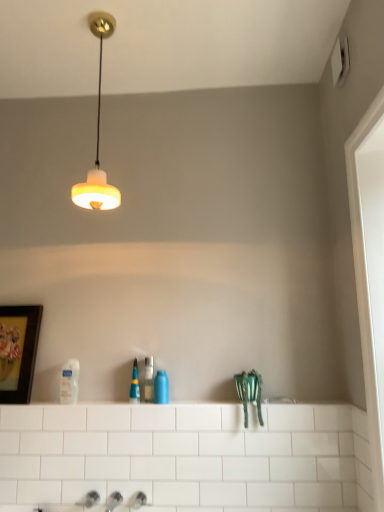
Where is `white glossy ledge at center`? Image resolution: width=384 pixels, height=512 pixels. white glossy ledge at center is located at coordinates (280, 400).

The image size is (384, 512). Find the location of `white glossy lotion at lower left, which is counted as the 3th toiletry, starting from the right`. white glossy lotion at lower left, which is counted as the 3th toiletry, starting from the right is located at coordinates (69, 382).

Identify the location of white glossy ledge at center. This screenshot has height=512, width=384. (280, 400).

Which is more distant, (154, 379) or (25, 392)?

The point (25, 392) is farther.

From a real-world perspective, is blue glossy bottle at center, which is the 1th toiletry in right-to-left order, over wooden framed artwork at left?

No, from a real-world perspective, blue glossy bottle at center, which is the 1th toiletry in right-to-left order, is not on top of wooden framed artwork at left.

Is blue glossy bottle at center, which is the third toiletry in left-to-right order, positioned far away from wooden framed artwork at left?

No, blue glossy bottle at center, which is the third toiletry in left-to-right order, is in close proximity to wooden framed artwork at left.

Is white glossy lotion at lower left, which is counted as the 3th toiletry, starting from the right, oriented away from matte white lampshade at upper center?

No, matte white lampshade at upper center is not at the back of white glossy lotion at lower left, which is counted as the 3th toiletry, starting from the right.

Between white glossy lotion at lower left, arranged as the first toiletry when viewed from the left, and matte white lampshade at upper center, which one appears on the right side from the viewer's perspective?

matte white lampshade at upper center is more to the right.

Which is closer to the camera, (x=61, y=381) or (x=105, y=175)?

The point (x=61, y=381) is closer to the camera.

Is translucent plastic bottle at center, the second toiletry from the left, taller or shorter than wooden framed artwork at left?

Clearly, translucent plastic bottle at center, the second toiletry from the left, is shorter compared to wooden framed artwork at left.

From the image's perspective, which object appears higher, translucent plastic bottle at center, marked as the 2th toiletry in a right-to-left arrangement, or wooden framed artwork at left?

wooden framed artwork at left is shown above in the image.

Is translucent plastic bottle at center, the second toiletry from the left, positioned with its back to wooden framed artwork at left?

No, wooden framed artwork at left is not at the back of translucent plastic bottle at center, the second toiletry from the left.

Does translucent plastic bottle at center, marked as the 2th toiletry in a right-to-left arrangement, have a lesser width compared to wooden framed artwork at left?

No.

At what (x,y) coordinates should I click in order to perform the action: click on ledge in front of the blue glossy bottle at center, which is the 1th toiletry in right-to-left order. Please return your answer as a coordinate pair (x, y). Looking at the image, I should click on (x=280, y=400).

Which object is thinner, white glossy ledge at center or blue glossy bottle at center, which is the third toiletry in left-to-right order?

Thinner between the two is blue glossy bottle at center, which is the third toiletry in left-to-right order.

Considering their positions, is white glossy ledge at center located in front of or behind blue glossy bottle at center, which is the 1th toiletry in right-to-left order?

white glossy ledge at center is positioned closer to the viewer than blue glossy bottle at center, which is the 1th toiletry in right-to-left order.

From the image's perspective, is white glossy ledge at center on top of blue glossy bottle at center, which is the third toiletry in left-to-right order?

No, from the image's perspective, white glossy ledge at center is not on top of blue glossy bottle at center, which is the third toiletry in left-to-right order.

Based on the photo, in the image, is white glossy lotion at lower left, which is counted as the 3th toiletry, starting from the right, positioned in front of or behind white glossy ledge at center?

white glossy lotion at lower left, which is counted as the 3th toiletry, starting from the right, is behind white glossy ledge at center.

Which toiletry is the 2nd one when counting from the back of the white glossy ledge at center? Please provide its 2D coordinates.

[(69, 382)]

Looking at this image, measure the distance between white glossy lotion at lower left, arranged as the first toiletry when viewed from the left, and white glossy ledge at center.

The distance of white glossy lotion at lower left, arranged as the first toiletry when viewed from the left, from white glossy ledge at center is 36.57 inches.

Which of these two, white glossy lotion at lower left, which is counted as the 3th toiletry, starting from the right, or white glossy ledge at center, is thinner?

With smaller width is white glossy lotion at lower left, which is counted as the 3th toiletry, starting from the right.

Is wooden framed artwork at left facing towards matte white lampshade at upper center?

No, wooden framed artwork at left is not aimed at matte white lampshade at upper center.

From the image's perspective, between wooden framed artwork at left and matte white lampshade at upper center, who is located below?

wooden framed artwork at left, from the image's perspective.

Between point (23, 371) and point (106, 13), which one is positioned in front?

Positioned in front is point (106, 13).

Measure the distance from translucent plastic bottle at center, marked as the 2th toiletry in a right-to-left arrangement, to white glossy lotion at lower left, which is counted as the 3th toiletry, starting from the right.

The distance of translucent plastic bottle at center, marked as the 2th toiletry in a right-to-left arrangement, from white glossy lotion at lower left, which is counted as the 3th toiletry, starting from the right, is 13.54 inches.

In the scene shown: From the image's perspective, between translucent plastic bottle at center, marked as the 2th toiletry in a right-to-left arrangement, and white glossy lotion at lower left, arranged as the first toiletry when viewed from the left, who is located below?

From the image's view, translucent plastic bottle at center, marked as the 2th toiletry in a right-to-left arrangement, is below.

Based on their sizes in the image, would you say translucent plastic bottle at center, marked as the 2th toiletry in a right-to-left arrangement, is bigger or smaller than white glossy lotion at lower left, arranged as the first toiletry when viewed from the left?

translucent plastic bottle at center, marked as the 2th toiletry in a right-to-left arrangement, is smaller than white glossy lotion at lower left, arranged as the first toiletry when viewed from the left.

Which object is thinner, translucent plastic bottle at center, the second toiletry from the left, or white glossy lotion at lower left, which is counted as the 3th toiletry, starting from the right?

white glossy lotion at lower left, which is counted as the 3th toiletry, starting from the right, is thinner.

At what (x,y) coordinates should I click in order to perform the action: click on picture frame above the blue glossy bottle at center, which is the 1th toiletry in right-to-left order (from a real-world perspective). Please return your answer as a coordinate pair (x, y). The width and height of the screenshot is (384, 512). Looking at the image, I should click on (20, 352).

From a real-world perspective, which toiletry is the 1st one underneath the matte white lampshade at upper center? Please provide its 2D coordinates.

[(69, 382)]

Looking at the image, which one is located further to white glossy lotion at lower left, arranged as the first toiletry when viewed from the left, blue glossy bottle at center, which is the third toiletry in left-to-right order, or white glossy door at right?

The object further to white glossy lotion at lower left, arranged as the first toiletry when viewed from the left, is white glossy door at right.

Based on their spatial positions, is wooden framed artwork at left or matte white lampshade at upper center closer to white glossy ledge at center?

wooden framed artwork at left is positioned closer to the anchor white glossy ledge at center.

Considering their positions, is white glossy door at right positioned closer to white glossy lotion at lower left, which is counted as the 3th toiletry, starting from the right, than white glossy ledge at center?

white glossy ledge at center is positioned closer to the anchor white glossy lotion at lower left, which is counted as the 3th toiletry, starting from the right.

Considering their positions, is white glossy door at right positioned further to matte white lampshade at upper center than wooden framed artwork at left?

Among the two, white glossy door at right is located further to matte white lampshade at upper center.

From the image, which object appears to be farther from matte white lampshade at upper center, wooden framed artwork at left or white glossy ledge at center?

white glossy ledge at center lies further to matte white lampshade at upper center than the other object.

Considering their positions, is white glossy ledge at center positioned further to wooden framed artwork at left than matte white lampshade at upper center?

The object further to wooden framed artwork at left is white glossy ledge at center.

Which object lies nearer to the anchor point blue glossy bottle at center, which is the third toiletry in left-to-right order, translucent plastic bottle at center, marked as the 2th toiletry in a right-to-left arrangement, or wooden framed artwork at left?

Among the two, translucent plastic bottle at center, marked as the 2th toiletry in a right-to-left arrangement, is located nearer to blue glossy bottle at center, which is the third toiletry in left-to-right order.

Considering their positions, is white glossy door at right positioned further to white glossy lotion at lower left, which is counted as the 3th toiletry, starting from the right, than matte white lampshade at upper center?

The object further to white glossy lotion at lower left, which is counted as the 3th toiletry, starting from the right, is white glossy door at right.

The width and height of the screenshot is (384, 512). I want to click on picture frame between matte white lampshade at upper center and white glossy ledge at center in the vertical direction, so click(x=20, y=352).

This screenshot has width=384, height=512. I want to click on toiletry between matte white lampshade at upper center and translucent plastic bottle at center, marked as the 2th toiletry in a right-to-left arrangement, from top to bottom, so click(x=69, y=382).

In order to click on screen door that lies between matte white lampshade at upper center and translucent plastic bottle at center, the second toiletry from the left, from top to bottom in this screenshot , I will do `click(365, 293)`.

What are the coordinates of `screen door between matte white lampshade at upper center and blue glossy bottle at center, which is the 1th toiletry in right-to-left order, vertically` in the screenshot? It's located at (365, 293).